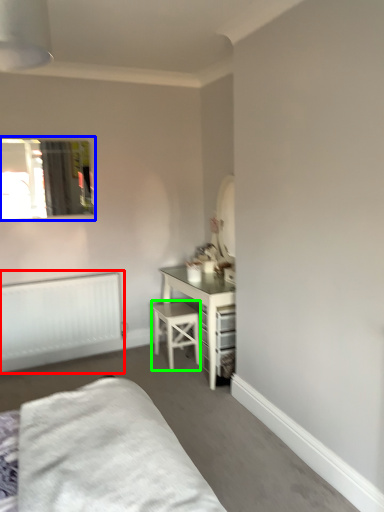
Question: Which object is the closest to the radiator (highlighted by a red box)? Choose among these: window (highlighted by a blue box) or stool (highlighted by a green box).

Choices:
 (A) window
 (B) stool

Answer: (B)